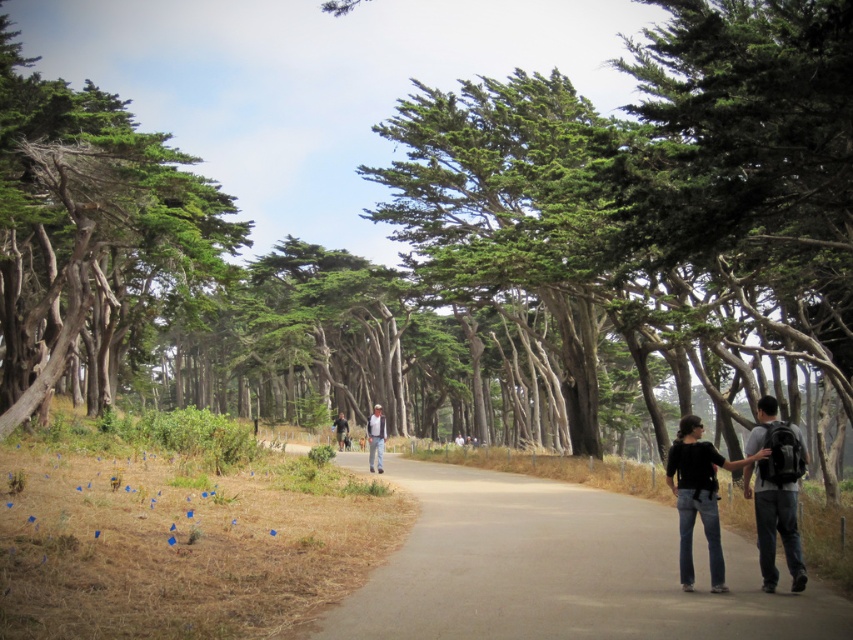
Is smooth asphalt path at center wider than dark gray backpack at right?

Correct, the width of smooth asphalt path at center exceeds that of dark gray backpack at right.

Does point (529, 518) lie behind point (767, 525)?

Yes.

Between point (549, 570) and point (769, 470), which one is positioned in front?

Point (769, 470) is more forward.

The width and height of the screenshot is (853, 640). I want to click on smooth asphalt path at center, so click(560, 570).

Does green textured trees at left have a smaller size compared to black denim jeans at right?

Incorrect, green textured trees at left is not smaller in size than black denim jeans at right.

Can you confirm if green textured trees at left is thinner than black denim jeans at right?

Incorrect, green textured trees at left's width is not less than black denim jeans at right's.

Who is more distant from viewer, (186, 259) or (701, 456)?

Positioned behind is point (186, 259).

Where is `green textured trees at left`? The width and height of the screenshot is (853, 640). green textured trees at left is located at coordinates (90, 234).

Who is positioned more to the right, green textured trees at left or light blue jeans at center?

From the viewer's perspective, light blue jeans at center appears more on the right side.

At what (x,y) coordinates should I click in order to perform the action: click on green textured trees at left. Please return your answer as a coordinate pair (x, y). Image resolution: width=853 pixels, height=640 pixels. Looking at the image, I should click on (90, 234).